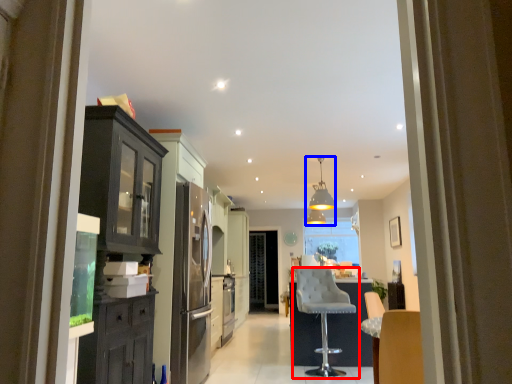
Question: Which object is further to the camera taking this photo, chair (highlighted by a red box) or light fixture (highlighted by a blue box)?

Choices:
 (A) chair
 (B) light fixture

Answer: (B)